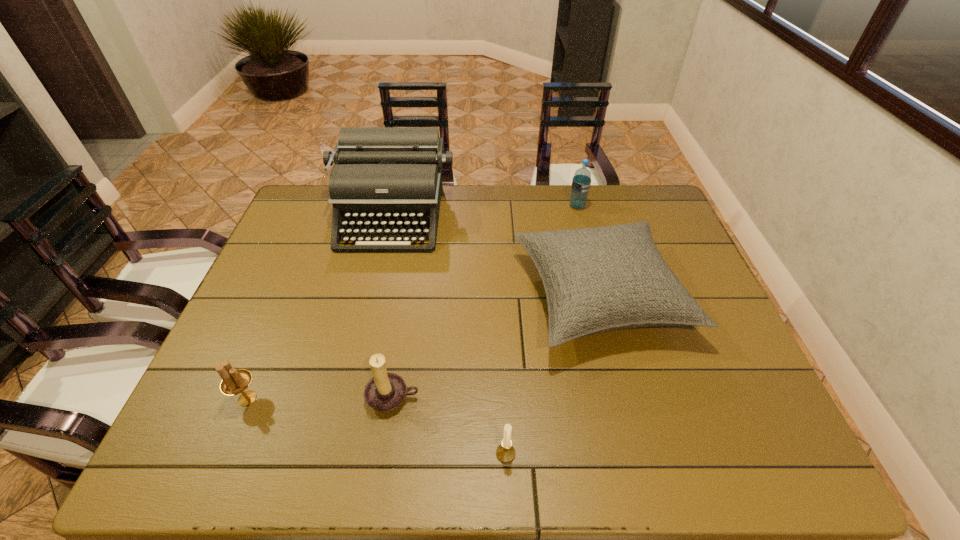
Identify the location of unoccupied position between the water bottle and the leftmost candle holder. The image size is (960, 540). 412,302.

Where is `unoccupied position between the leftmost candle holder and the shortest candle holder`? The height and width of the screenshot is (540, 960). unoccupied position between the leftmost candle holder and the shortest candle holder is located at coordinates (376, 426).

Locate an element on the screen. vacant space that's between the second candle holder from left to right and the water bottle is located at coordinates [x=485, y=302].

Identify the location of vacant region between the tallest object and the leftmost candle holder. (320, 307).

This screenshot has height=540, width=960. In order to click on object that is the fifth closest one to the second candle holder from right to left in this screenshot , I will do `click(581, 182)`.

Find the location of a particular element. This screenshot has height=540, width=960. the fifth closest object to the typewriter is located at coordinates (505, 452).

Locate an element on the screen. The image size is (960, 540). candle holder object that ranks as the closest to the water bottle is located at coordinates (385, 391).

The width and height of the screenshot is (960, 540). Find the location of `candle holder identified as the closest to the leftmost candle holder`. candle holder identified as the closest to the leftmost candle holder is located at coordinates (385, 391).

The height and width of the screenshot is (540, 960). I want to click on free location that satisfies the following two spatial constraints: 1. on the back side of the water bottle; 2. on the right side of the cushion, so click(x=576, y=206).

Where is `vacant space that satisfies the following two spatial constraints: 1. on the back side of the water bottle; 2. on the right side of the leftmost candle holder`? This screenshot has width=960, height=540. vacant space that satisfies the following two spatial constraints: 1. on the back side of the water bottle; 2. on the right side of the leftmost candle holder is located at coordinates (326, 206).